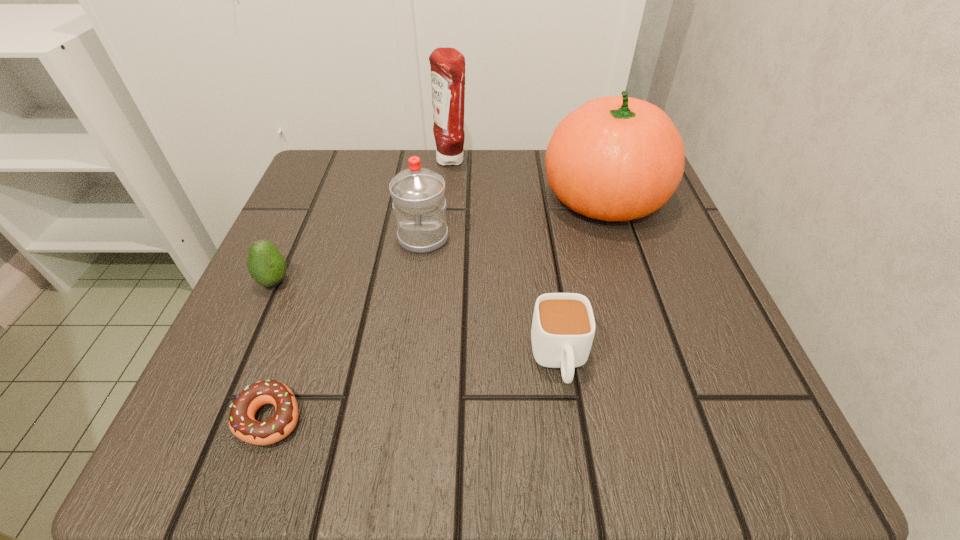
Locate an element on the screen. vacant space located on the handle side of the water bottle is located at coordinates (407, 355).

Locate an element on the screen. This screenshot has width=960, height=540. vacant point located 0.120m on the right of the leftmost object is located at coordinates (364, 281).

Where is `vacant space located on the side with the handle of the cup`? vacant space located on the side with the handle of the cup is located at coordinates (570, 434).

Locate an element on the screen. The image size is (960, 540). free space located 0.260m on the back of the second object from left to right is located at coordinates (326, 256).

Where is `condiment at the far edge`? Image resolution: width=960 pixels, height=540 pixels. condiment at the far edge is located at coordinates (447, 64).

Identify the location of pumpkin at the far edge. (616, 158).

Identify the location of object present at the near edge. (242, 423).

Locate an element on the screen. The height and width of the screenshot is (540, 960). avocado that is at the left edge is located at coordinates (267, 266).

Locate an element on the screen. doughnut at the left edge is located at coordinates (242, 423).

In order to click on object at the right edge in this screenshot , I will do `click(616, 158)`.